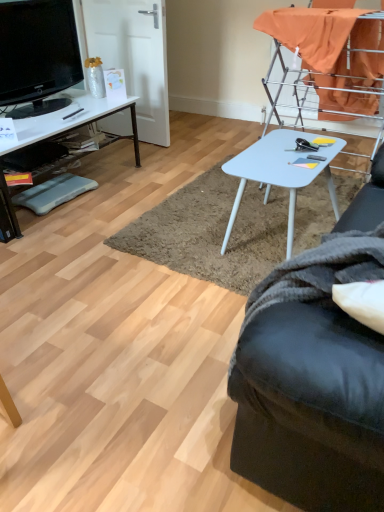
Question: Can you confirm if white plastic table at center is smaller than black glossy television at upper left?

Choices:
 (A) no
 (B) yes

Answer: (A)

Question: Does white plastic table at center appear on the right side of black glossy television at upper left?

Choices:
 (A) yes
 (B) no

Answer: (A)

Question: Does white plastic table at center have a greater height compared to black glossy television at upper left?

Choices:
 (A) yes
 (B) no

Answer: (A)

Question: Is white plastic table at center facing towards black glossy television at upper left?

Choices:
 (A) yes
 (B) no

Answer: (A)

Question: Does white plastic table at center contain black glossy television at upper left?

Choices:
 (A) no
 (B) yes

Answer: (A)

Question: From a real-world perspective, is white plastic table at center beneath black glossy television at upper left?

Choices:
 (A) no
 (B) yes

Answer: (B)

Question: From the image's perspective, is black fabric studio couch at lower right under blue foam footrest at lower left?

Choices:
 (A) no
 (B) yes

Answer: (B)

Question: Is black fabric studio couch at lower right thinner than blue foam footrest at lower left?

Choices:
 (A) yes
 (B) no

Answer: (B)

Question: Is black fabric studio couch at lower right not inside blue foam footrest at lower left?

Choices:
 (A) yes
 (B) no

Answer: (A)

Question: Can you confirm if black fabric studio couch at lower right is shorter than blue foam footrest at lower left?

Choices:
 (A) no
 (B) yes

Answer: (A)

Question: Considering the relative positions of black fabric studio couch at lower right and blue foam footrest at lower left in the image provided, is black fabric studio couch at lower right to the right of blue foam footrest at lower left from the viewer's perspective?

Choices:
 (A) yes
 (B) no

Answer: (A)

Question: Can blue foam footrest at lower left be found inside black fabric studio couch at lower right?

Choices:
 (A) no
 (B) yes

Answer: (A)

Question: Is blue foam footrest at lower left not inside white glossy desk at left?

Choices:
 (A) no
 (B) yes

Answer: (A)